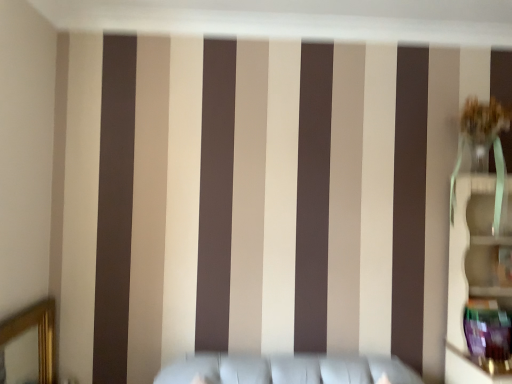
I want to click on translucent glass vase at right, so pyautogui.click(x=483, y=145).

What do you see at coordinates (483, 145) in the screenshot? I see `translucent glass vase at right` at bounding box center [483, 145].

Identify the location of translucent glass vase at right. (483, 145).